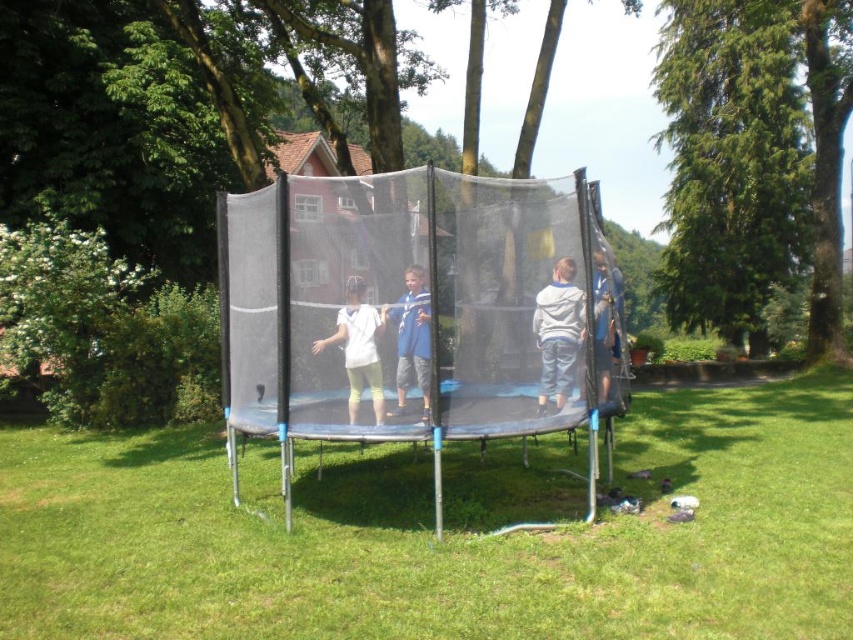
You are a parent supervising children on the playground. You notice the black rubber trampoline at center and the black mesh net at center. Which object is positioned to the left?

The black rubber trampoline at center is to the left of the black mesh net at center.

You are planning to set up a new trampoline in your backyard. You have a space that can accommodate a trampoline wider than its net enclosure. Based on the image, does the black rubber trampoline at center fit in your space if the black mesh net at center is already placed there?

The black rubber trampoline at center is wider than the black mesh net at center, so if the space can accommodate a trampoline wider than its net enclosure, then the black rubber trampoline at center would fit in the space even if the black mesh net at center is already placed there.